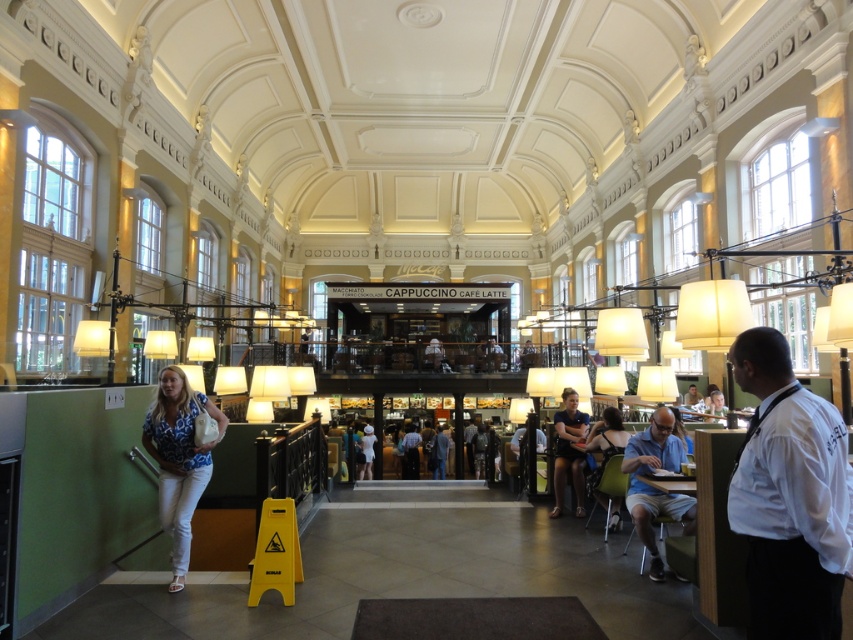
Is blue printed blouse at lower left wider than light blue shirt at lower right?

No.

Is point (207, 452) farther from viewer compared to point (657, 512)?

No, it is in front of (657, 512).

Which is behind, point (189, 504) or point (645, 454)?

The point (645, 454) is behind.

Locate an element on the screen. The width and height of the screenshot is (853, 640). blue printed blouse at lower left is located at coordinates (178, 460).

Does white shirt at right have a greater width compared to matte black dress at center?

Yes, white shirt at right is wider than matte black dress at center.

Who is shorter, white shirt at right or matte black dress at center?

With less height is matte black dress at center.

Does point (740, 486) come farther from viewer compared to point (592, 445)?

No, (740, 486) is in front of (592, 445).

Identify the location of white shirt at right. The image size is (853, 640). (788, 497).

Can you confirm if dark blue shirt at center is wider than matte black dress at center?

Correct, the width of dark blue shirt at center exceeds that of matte black dress at center.

From the picture: Can you confirm if dark blue shirt at center is positioned above matte black dress at center?

Incorrect, dark blue shirt at center is not positioned above matte black dress at center.

The width and height of the screenshot is (853, 640). I want to click on dark blue shirt at center, so click(x=567, y=451).

In order to click on dark blue shirt at center in this screenshot , I will do `click(567, 451)`.